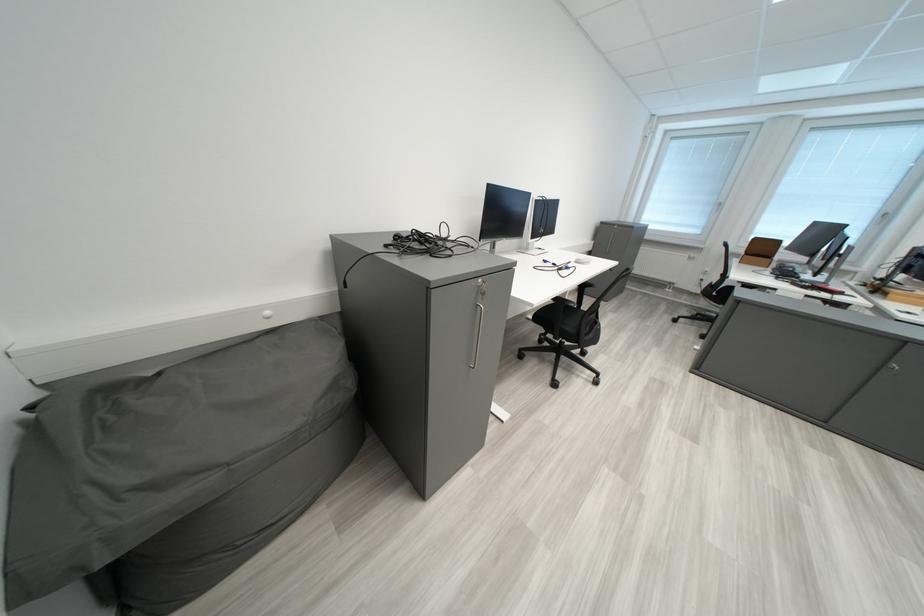
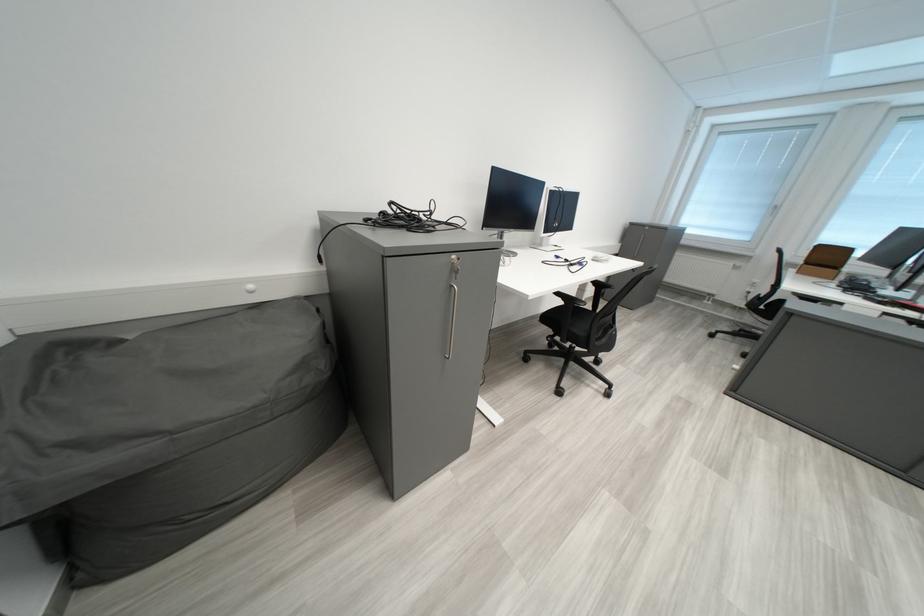
Which direction would the cameraman need to move to produce the second image?

The cameraman moved toward right, forward.